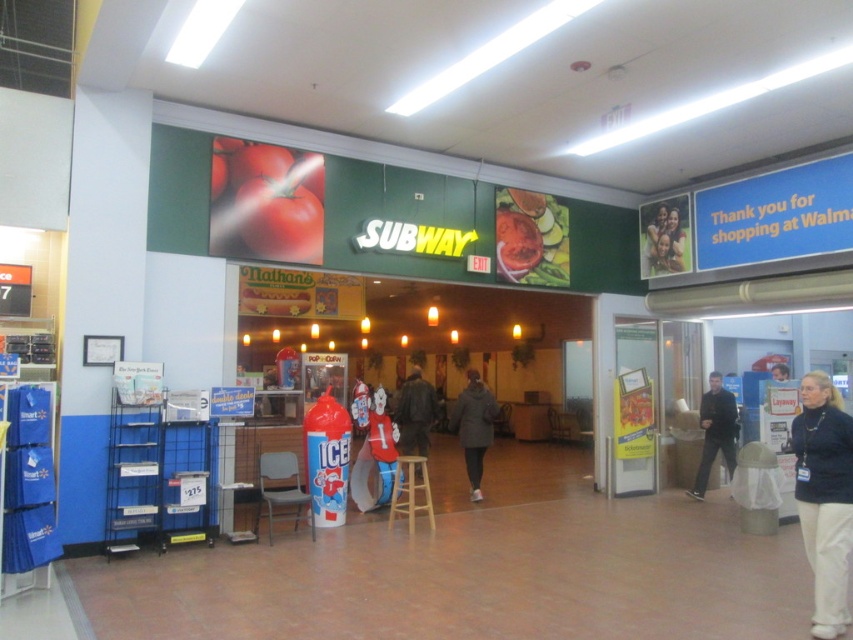
Is tomato matte at center positioned behind brown wooden stool at center?

That is True.

Does tomato matte at center have a smaller size compared to brown wooden stool at center?

No, tomato matte at center is not smaller than brown wooden stool at center.

Is point (538, 193) farther from viewer compared to point (418, 490)?

Yes.

You are a GUI agent. You are given a task and a screenshot of the screen. Output one action in this format:
    pyautogui.click(x=<x>, y=<y>)
    Task: Click on the tomato matte at center
    
    Given the screenshot: What is the action you would take?
    pyautogui.click(x=531, y=237)

Which is more to the left, tomato matte at center or dark gray sweater at right?

Positioned to the left is tomato matte at center.

Consider the image. Who is more forward, (563,248) or (717,451)?

Point (717,451) is in front.

Identify the location of tomato matte at center. (531, 237).

Who is taller, black fabric pants at lower right or brown wooden stool at center?

black fabric pants at lower right

Is point (834, 518) more distant than point (410, 483)?

No, it is not.

Does point (848, 428) come closer to viewer compared to point (405, 476)?

Yes, it is.

This screenshot has width=853, height=640. Identify the location of black fabric pants at lower right. (824, 499).